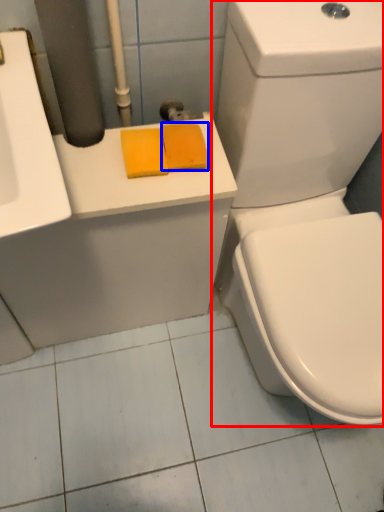
Question: Among these objects, which one is farthest to the camera, toilet (highlighted by a red box) or soap (highlighted by a blue box)?

Choices:
 (A) toilet
 (B) soap

Answer: (B)